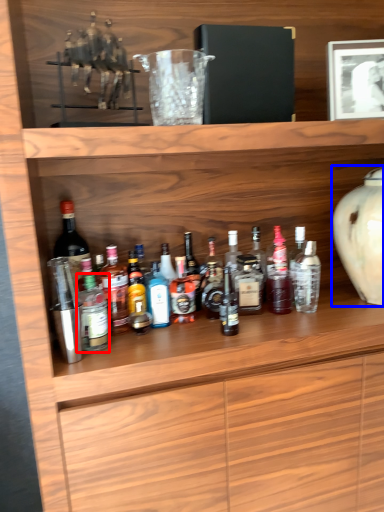
Question: Which of the following is the farthest to the observer, bottle (highlighted by a red box) or vase (highlighted by a blue box)?

Choices:
 (A) bottle
 (B) vase

Answer: (B)